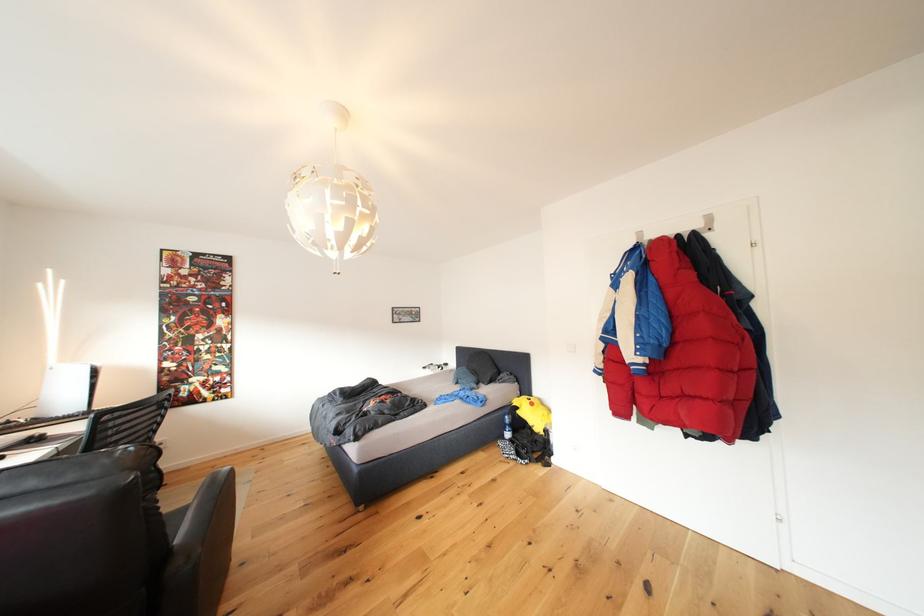
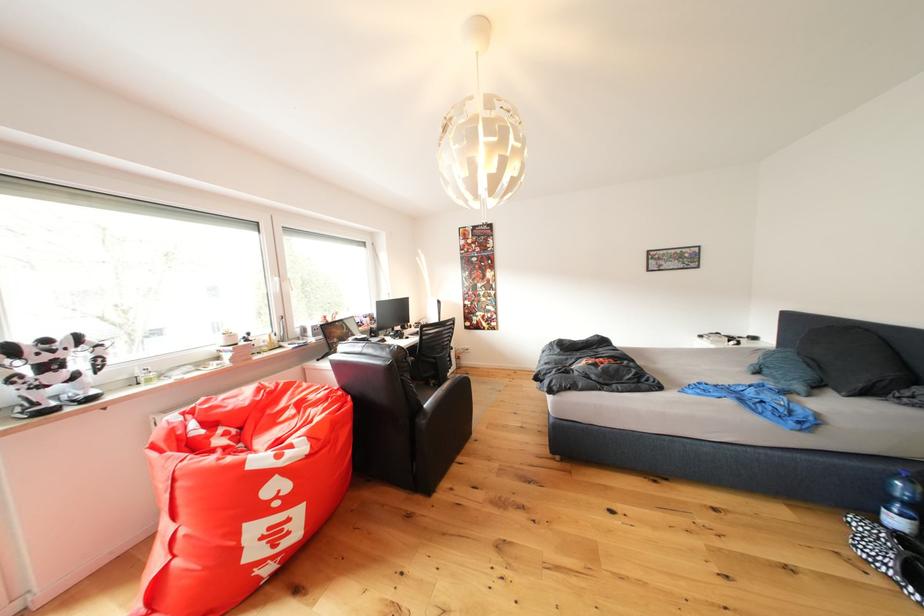
In the second image, find the point that corresponds to [517,440] in the first image.

(906, 527)